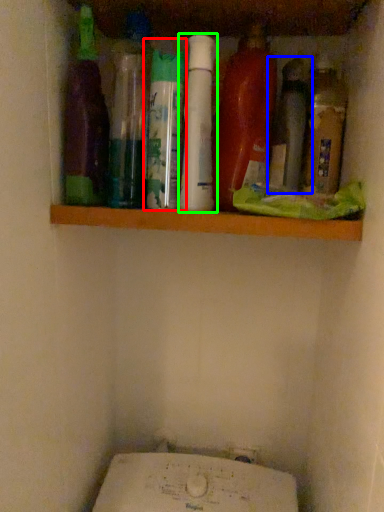
Question: Considering the real-world distances, which object is farthest from bottle (highlighted by a red box)? bottle (highlighted by a blue box) or bottle (highlighted by a green box)?

Choices:
 (A) bottle
 (B) bottle

Answer: (A)